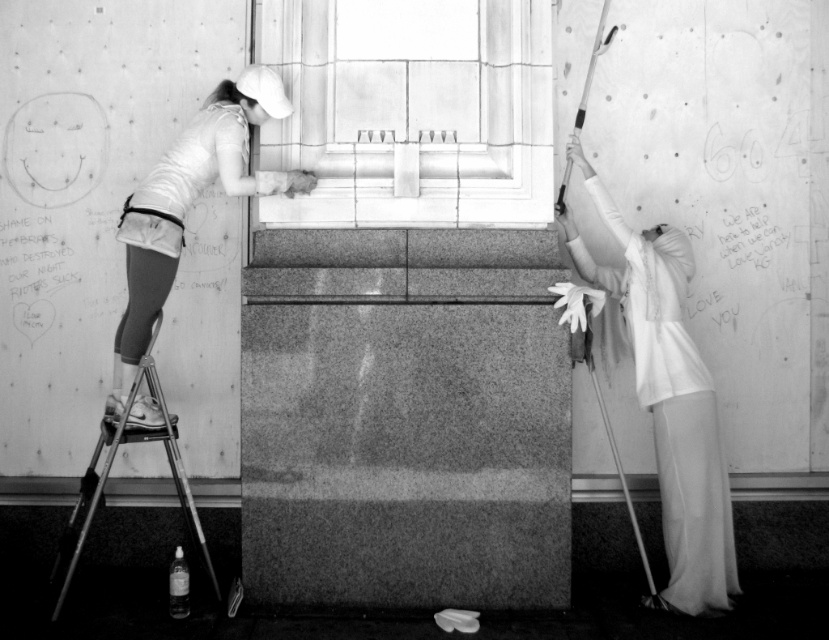
You are standing at the point closest to the window frame. Which point are you at, point [650,282] or point [168,432]?

Point [168,432] is closer to the window frame, so you are at point [168,432].

You are a visitor observing the scene. You notice the smooth stone window at center and the matte white shirt at upper left. Which object is positioned to the right side of the other?

The smooth stone window at center is to the right of matte white shirt at upper left.

What is located at the point with coordinates (410,112) in the image?

The smooth stone window at center is located at the point with coordinates (410,112).